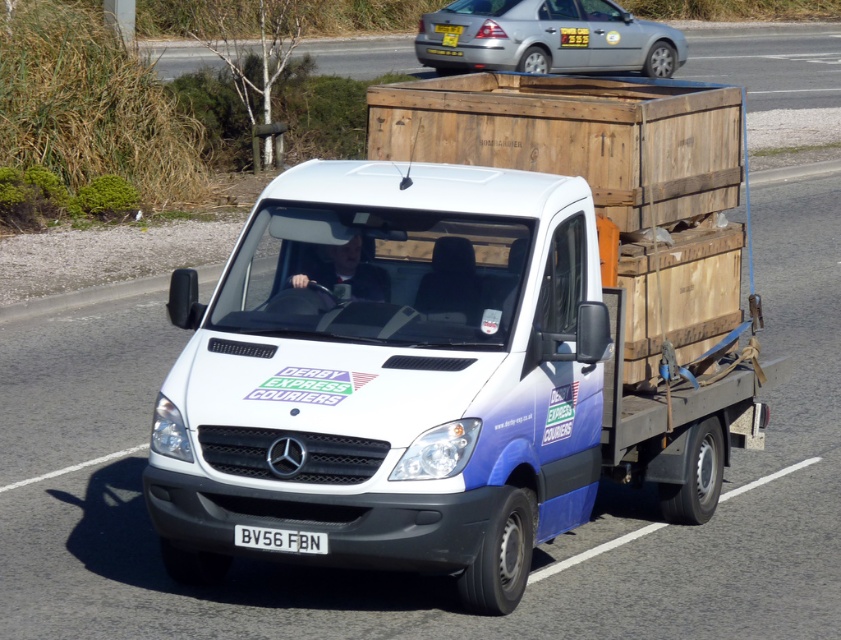
Is white matte van at center taller than silver metallic sedan at upper center?

Correct, white matte van at center is much taller as silver metallic sedan at upper center.

From the picture: Is the position of white matte van at center less distant than that of silver metallic sedan at upper center?

That is True.

Is point (501, 360) positioned in front of point (543, 68)?

Yes, point (501, 360) is closer to viewer.

Identify the location of white matte van at center. The width and height of the screenshot is (841, 640). (421, 381).

Who is more distant from viewer, (475, 65) or (295, 531)?

Point (475, 65)

Is the position of silver metallic sedan at upper center more distant than that of white plastic license plate at center?

Yes, silver metallic sedan at upper center is further from the viewer.

You are a GUI agent. You are given a task and a screenshot of the screen. Output one action in this format:
    pyautogui.click(x=<x>, y=<y>)
    Task: Click on the silver metallic sedan at upper center
    
    Given the screenshot: What is the action you would take?
    pyautogui.click(x=545, y=36)

Who is higher up, white matte van at center or white plastic license plate at center?

Positioned higher is white matte van at center.

Can you confirm if white matte van at center is positioned to the left of white plastic license plate at center?

Incorrect, white matte van at center is not on the left side of white plastic license plate at center.

Image resolution: width=841 pixels, height=640 pixels. Find the location of `white matte van at center`. white matte van at center is located at coordinates (421, 381).